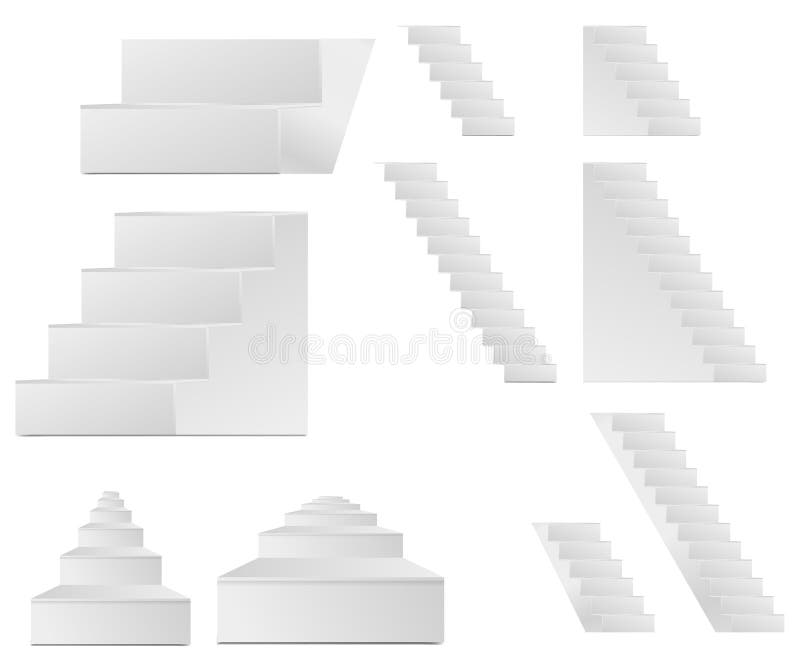
This screenshot has width=800, height=670. In order to click on stair sets in this screenshot , I will do [265, 92], [466, 88], [646, 100], [658, 281], [502, 306], [200, 350], [110, 585], [353, 594], [590, 597], [704, 557].